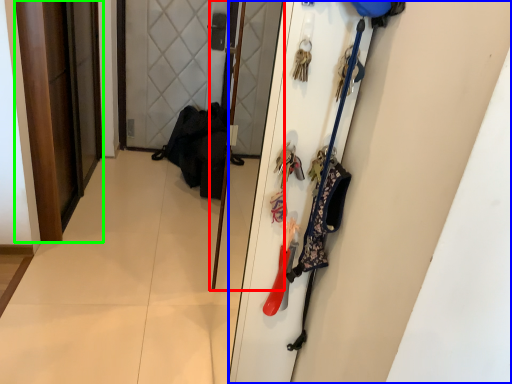
Question: Estimate the real-world distances between objects in this image. Which object is farther from screen door (highlighted by a red box), door (highlighted by a blue box) or door (highlighted by a green box)?

Choices:
 (A) door
 (B) door

Answer: (A)